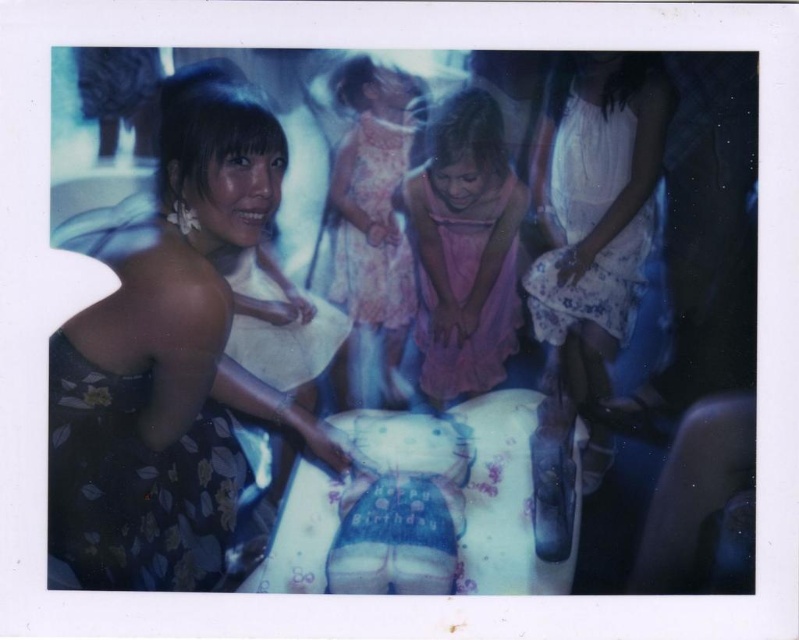
Is pink satin dress at center above pink floral dress at center?

Incorrect, pink satin dress at center is not positioned above pink floral dress at center.

Is pink satin dress at center further to camera compared to pink floral dress at center?

Yes, it is behind pink floral dress at center.

Does point (426, 385) lie in front of point (378, 177)?

No, it is behind (378, 177).

You are a GUI agent. You are given a task and a screenshot of the screen. Output one action in this format:
    pyautogui.click(x=<x>, y=<y>)
    Task: Click on the pink satin dress at center
    The width and height of the screenshot is (799, 640).
    Given the screenshot: What is the action you would take?
    pyautogui.click(x=464, y=248)

Consider the image. Does floral dress at left have a lesser width compared to pink floral dress at center?

Incorrect, floral dress at left's width is not less than pink floral dress at center's.

From the picture: Is floral dress at left to the right of pink floral dress at center from the viewer's perspective?

No, floral dress at left is not to the right of pink floral dress at center.

Does point (235, 136) come in front of point (382, 65)?

No, it is behind (382, 65).

Image resolution: width=799 pixels, height=640 pixels. Find the location of `floral dress at left`. floral dress at left is located at coordinates pyautogui.click(x=169, y=353).

Who is taller, floral dress at left or pink satin dress at center?

With more height is floral dress at left.

Between floral dress at left and pink satin dress at center, which one is positioned higher?

pink satin dress at center is above.

What are the coordinates of `floral dress at left` in the screenshot? It's located at (169, 353).